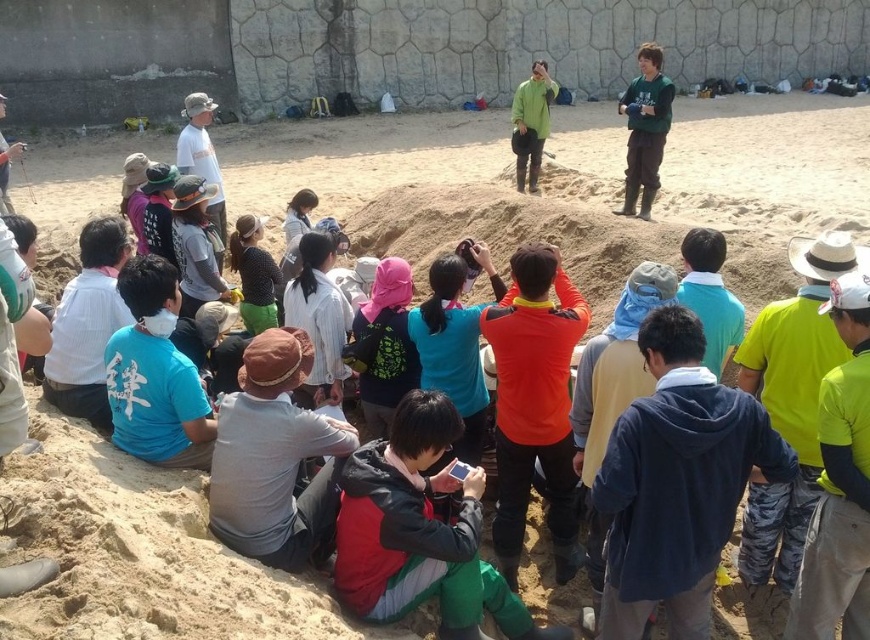
Question: Which is farther from the reddish-orange hoodie at center?

Choices:
 (A) green matte jacket at upper right
 (B) green matte jacket at center

Answer: (B)

Question: Can you confirm if reddish-orange hoodie at center is positioned below green matte jacket at upper right?

Choices:
 (A) no
 (B) yes

Answer: (B)

Question: Considering the real-world distances, which object is farthest from the green matte jacket at upper right?

Choices:
 (A) reddish-orange hoodie at center
 (B) green matte jacket at center

Answer: (A)

Question: Which point is farther from the camera taking this photo?

Choices:
 (A) (653, 116)
 (B) (512, 122)

Answer: (B)

Question: In this image, where is reddish-orange hoodie at center located relative to green matte jacket at center?

Choices:
 (A) above
 (B) below

Answer: (B)

Question: Is green matte jacket at upper right in front of green matte jacket at center?

Choices:
 (A) no
 (B) yes

Answer: (B)